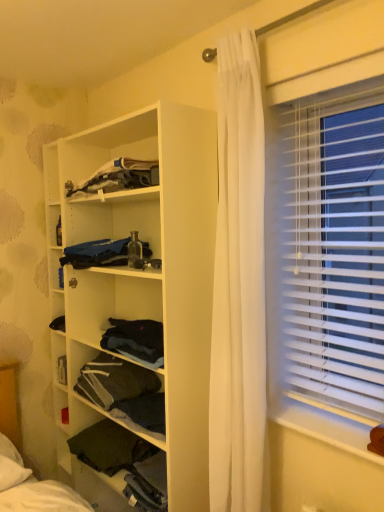
Question: Considering the relative sizes of dark fabric at center, placed as the second shelf when sorted from bottom to top, and white matte wooden shelf at center, which is the 1th shelf from top to bottom, in the image provided, is dark fabric at center, placed as the second shelf when sorted from bottom to top, bigger than white matte wooden shelf at center, which is the 1th shelf from top to bottom,?

Choices:
 (A) no
 (B) yes

Answer: (A)

Question: Does dark fabric at center, placed as the second shelf when sorted from bottom to top, appear on the left side of white matte wooden shelf at center, which is the 1th shelf from top to bottom?

Choices:
 (A) yes
 (B) no

Answer: (A)

Question: From the image's perspective, would you say dark fabric at center, placed as the second shelf when sorted from bottom to top, is shown under white matte wooden shelf at center, which appears as the 3th shelf when ordered from the bottom?

Choices:
 (A) yes
 (B) no

Answer: (A)

Question: Is dark fabric at center, acting as the second shelf starting from the top, behind white matte wooden shelf at center, which appears as the 3th shelf when ordered from the bottom?

Choices:
 (A) no
 (B) yes

Answer: (B)

Question: Considering the relative sizes of dark fabric at center, placed as the second shelf when sorted from bottom to top, and white matte wooden shelf at center, which appears as the 3th shelf when ordered from the bottom, in the image provided, is dark fabric at center, placed as the second shelf when sorted from bottom to top, smaller than white matte wooden shelf at center, which appears as the 3th shelf when ordered from the bottom,?

Choices:
 (A) no
 (B) yes

Answer: (B)

Question: Does dark fabric at center, acting as the second shelf starting from the top, contain white matte wooden shelf at center, which is the 1th shelf from top to bottom?

Choices:
 (A) no
 (B) yes

Answer: (A)

Question: From a real-world perspective, is white matte wooden shelf at center, which is the 1th shelf from top to bottom, positioned over white plastic window sill at lower right based on gravity?

Choices:
 (A) no
 (B) yes

Answer: (B)

Question: Does white matte wooden shelf at center, which appears as the 3th shelf when ordered from the bottom, have a greater height compared to white plastic window sill at lower right?

Choices:
 (A) no
 (B) yes

Answer: (B)

Question: From the image's perspective, is white matte wooden shelf at center, which appears as the 3th shelf when ordered from the bottom, above white plastic window sill at lower right?

Choices:
 (A) no
 (B) yes

Answer: (B)

Question: Is white matte wooden shelf at center, which appears as the 3th shelf when ordered from the bottom, turned away from white plastic window sill at lower right?

Choices:
 (A) no
 (B) yes

Answer: (A)

Question: Would you say white matte wooden shelf at center, which appears as the 3th shelf when ordered from the bottom, is outside white plastic window sill at lower right?

Choices:
 (A) no
 (B) yes

Answer: (B)

Question: Is white matte wooden shelf at center, which appears as the 3th shelf when ordered from the bottom, bigger than white plastic window sill at lower right?

Choices:
 (A) yes
 (B) no

Answer: (A)

Question: Would you say dark fabric at lower left, the first shelf from the bottom, is part of white plastic window sill at lower right's contents?

Choices:
 (A) no
 (B) yes

Answer: (A)